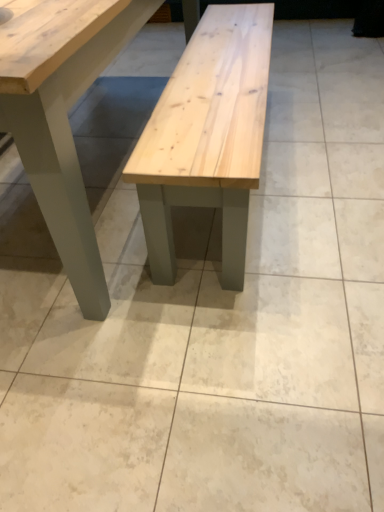
Where is `empty space that is to the right of natural wood table at center`? This screenshot has width=384, height=512. empty space that is to the right of natural wood table at center is located at coordinates (313, 129).